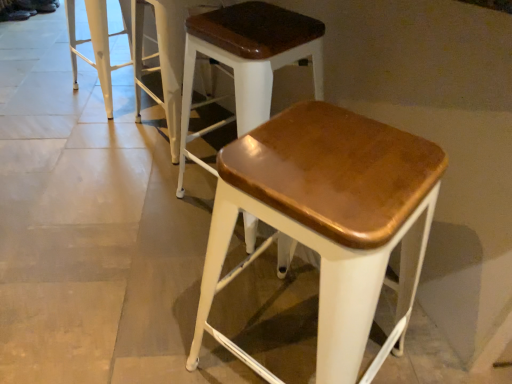
Question: Is matte brown wood stool at center, marked as the 1th stool in a right-to-left arrangement, outside wooden seat stool at center, the third stool from the right?

Choices:
 (A) yes
 (B) no

Answer: (A)

Question: Is matte brown wood stool at center, marked as the 1th stool in a right-to-left arrangement, in contact with wooden seat stool at center, the third stool from the right?

Choices:
 (A) yes
 (B) no

Answer: (B)

Question: Is matte brown wood stool at center, marked as the 1th stool in a right-to-left arrangement, taller than wooden seat stool at center, the third stool from the right?

Choices:
 (A) yes
 (B) no

Answer: (A)

Question: Would you say wooden seat stool at center, the second stool in the left-to-right sequence, is part of matte brown wood stool at center, marked as the 1th stool in a right-to-left arrangement,'s contents?

Choices:
 (A) yes
 (B) no

Answer: (B)

Question: Is the position of matte brown wood stool at center, which ranks as the 4th stool in left-to-right order, less distant than that of wooden seat stool at center, the third stool from the right?

Choices:
 (A) yes
 (B) no

Answer: (A)

Question: Considering the relative sizes of matte brown wood stool at center, marked as the 1th stool in a right-to-left arrangement, and wooden seat stool at center, the second stool in the left-to-right sequence, in the image provided, is matte brown wood stool at center, marked as the 1th stool in a right-to-left arrangement, thinner than wooden seat stool at center, the second stool in the left-to-right sequence,?

Choices:
 (A) yes
 (B) no

Answer: (B)

Question: Is matte brown wood stool at center, the 3th stool positioned from the left, touching wooden seat stool at center, the third stool from the right?

Choices:
 (A) yes
 (B) no

Answer: (B)

Question: From a real-world perspective, is matte brown wood stool at center, the 3th stool positioned from the left, physically below wooden seat stool at center, the third stool from the right?

Choices:
 (A) no
 (B) yes

Answer: (A)

Question: Can you confirm if matte brown wood stool at center, which ranks as the second stool in right-to-left order, is taller than wooden seat stool at center, the third stool from the right?

Choices:
 (A) yes
 (B) no

Answer: (A)

Question: Considering the relative sizes of matte brown wood stool at center, which ranks as the second stool in right-to-left order, and wooden seat stool at center, the third stool from the right, in the image provided, is matte brown wood stool at center, which ranks as the second stool in right-to-left order, shorter than wooden seat stool at center, the third stool from the right,?

Choices:
 (A) yes
 (B) no

Answer: (B)

Question: Is the position of matte brown wood stool at center, which ranks as the second stool in right-to-left order, less distant than that of wooden seat stool at center, the second stool in the left-to-right sequence?

Choices:
 (A) yes
 (B) no

Answer: (A)

Question: From the image's perspective, is matte brown wood stool at center, the 3th stool positioned from the left, located above wooden seat stool at center, the second stool in the left-to-right sequence?

Choices:
 (A) yes
 (B) no

Answer: (B)

Question: Is white metal stool at upper left, which is the first stool in left-to-right order, aimed at matte brown wood stool at center, the 3th stool positioned from the left?

Choices:
 (A) no
 (B) yes

Answer: (A)